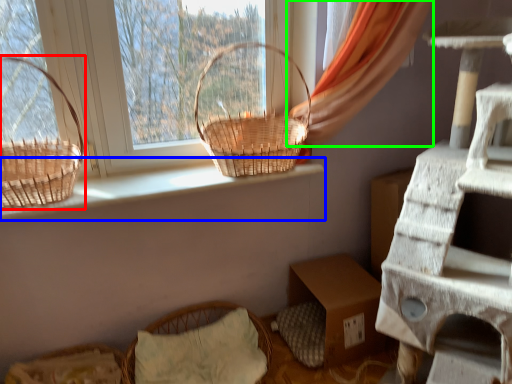
Question: Considering the real-world distances, which object is closest to picnic basket (highlighted by a red box)? window sill (highlighted by a blue box) or curtain (highlighted by a green box).

Choices:
 (A) window sill
 (B) curtain

Answer: (A)